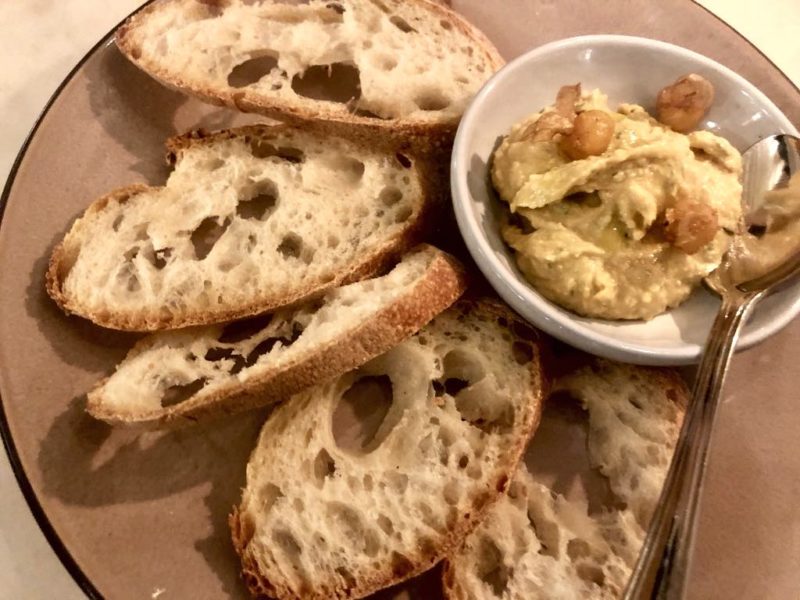
This screenshot has width=800, height=600. Identify the location of table. (60, 581).